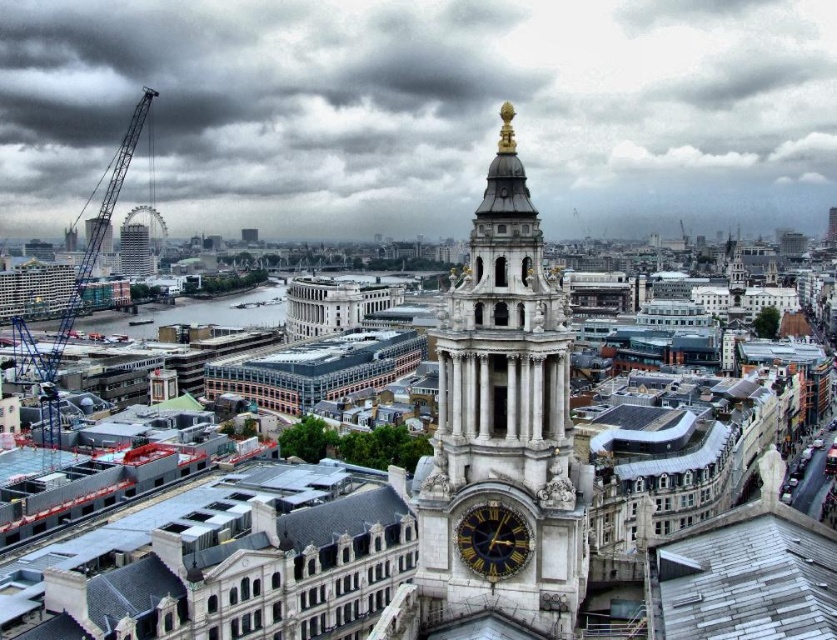
Question: Among these points, which one is nearest to the camera?

Choices:
 (A) (504, 512)
 (B) (49, 356)

Answer: (A)

Question: Which object is farther from the camera taking this photo?

Choices:
 (A) blue metallic crane at left
 (B) gold-toned metal clock at center-right

Answer: (A)

Question: Is white stone clock tower at center bigger than matte gray skyscraper at left?

Choices:
 (A) yes
 (B) no

Answer: (A)

Question: Which point is farther to the camera?

Choices:
 (A) (127, 272)
 (B) (473, 547)

Answer: (A)

Question: Can you confirm if white stone clock tower at center is positioned to the right of blue metallic crane at left?

Choices:
 (A) no
 (B) yes

Answer: (B)

Question: From the image, what is the correct spatial relationship of white stone clock tower at center in relation to blue metallic crane at left?

Choices:
 (A) left
 (B) right

Answer: (B)